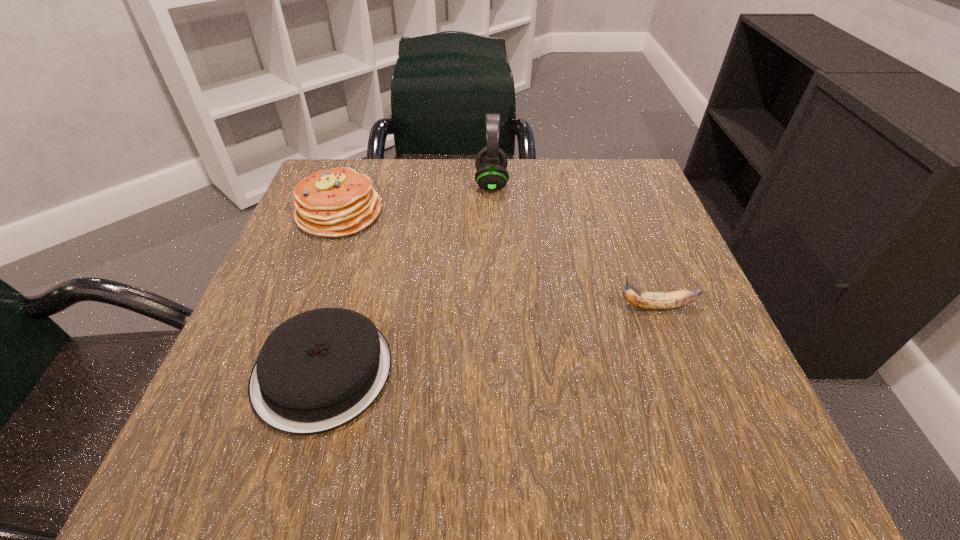
The height and width of the screenshot is (540, 960). In order to click on vacant space that satisfies the following two spatial constraints: 1. on the ear cups of the tallest object; 2. on the front side of the farther pancake in this screenshot , I will do `click(492, 213)`.

Where is `free space that satisfies the following two spatial constraints: 1. on the ear cups of the tallest object; 2. on the front side of the nearer pancake`? The width and height of the screenshot is (960, 540). free space that satisfies the following two spatial constraints: 1. on the ear cups of the tallest object; 2. on the front side of the nearer pancake is located at coordinates (497, 372).